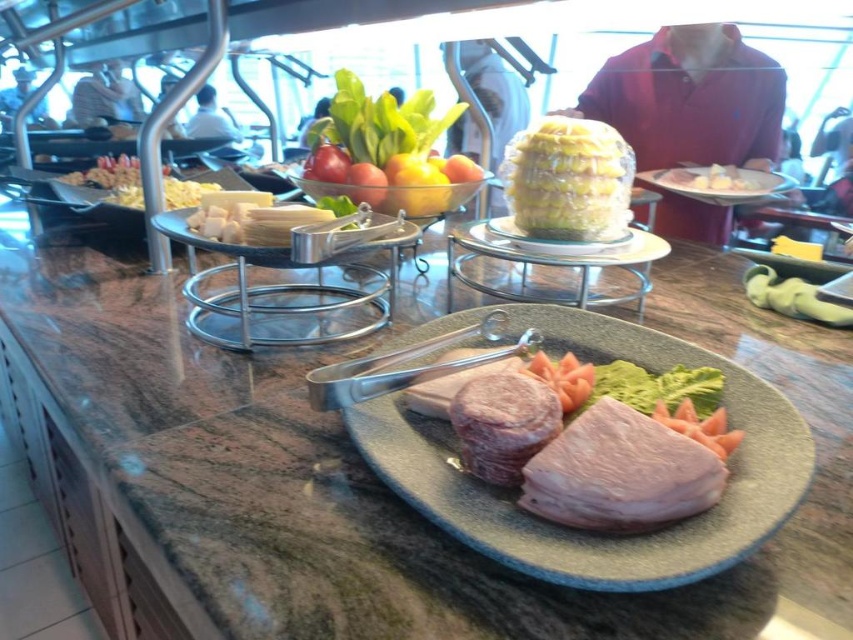
Consider the image. You are a customer at the buffet and want to grab the pinkish smooth sausage at center and the white plastic plate at center. Which one can you reach first without moving your position?

The pinkish smooth sausage at center is closer to the viewer than the white plastic plate at center, so you can reach it first without moving.

You are a chef organizing the buffet and notice the pinkish smooth sausage at center and the white plastic plate at center. Which item is located below the other?

The pinkish smooth sausage at center is positioned under the white plastic plate at center, so the sausage is below the plate.

You are a chef who needs to place a pinkish smooth sausage at center onto a white plastic plate at center. The minimum distance required for the sausage to be placed onto the plate is 3 feet. Can you place it?

The pinkish smooth sausage at center is 4.00 feet away from the white plastic plate at center. Since the minimum distance required is 3 feet, the chef can place the sausage onto the plate as the distance is sufficient.